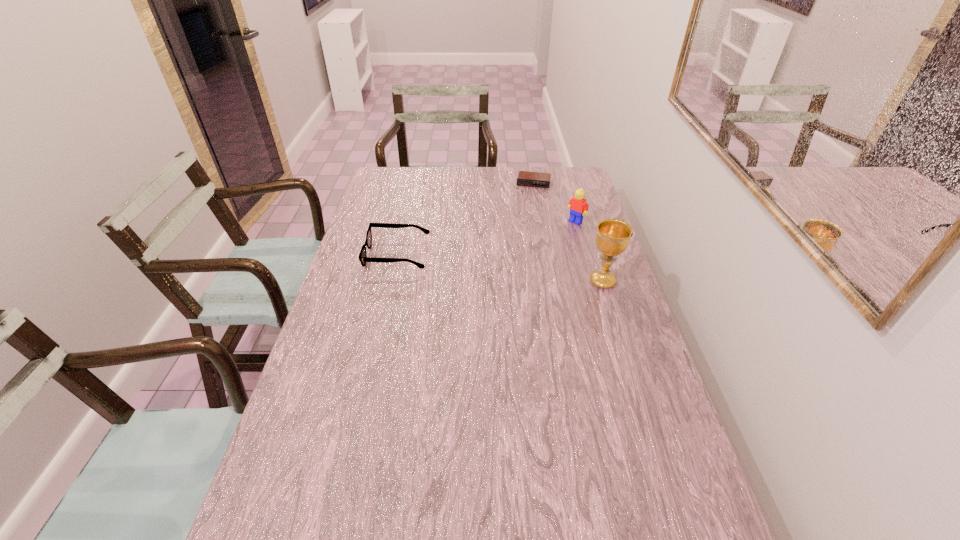
At what (x,y) coordinates should I click in order to perform the action: click on object located at the far right corner. Please return your answer as a coordinate pair (x, y). This screenshot has width=960, height=540. Looking at the image, I should click on (525, 178).

This screenshot has width=960, height=540. I want to click on vacant area at the far edge, so click(x=490, y=178).

Locate an element on the screen. Image resolution: width=960 pixels, height=540 pixels. free region at the near edge of the desktop is located at coordinates (527, 531).

Image resolution: width=960 pixels, height=540 pixels. Find the location of `free spot at the left edge of the desktop`. free spot at the left edge of the desktop is located at coordinates (365, 210).

You are a GUI agent. You are given a task and a screenshot of the screen. Output one action in this format:
    pyautogui.click(x=<x>, y=<y>)
    Task: Click on the blank space at the right edge of the desktop
    This screenshot has width=960, height=540.
    Given the screenshot: What is the action you would take?
    pyautogui.click(x=595, y=343)

Where is `vacant space at the far left corner of the desktop`? The height and width of the screenshot is (540, 960). vacant space at the far left corner of the desktop is located at coordinates (408, 173).

You are a GUI agent. You are given a task and a screenshot of the screen. Output one action in this format:
    pyautogui.click(x=<x>, y=<y>)
    Task: Click on the free location at the far right corner
    The image size is (960, 540).
    Given the screenshot: What is the action you would take?
    pyautogui.click(x=588, y=188)

Find the location of a particular element. free spot between the leftmost object and the tallest object is located at coordinates (500, 268).

This screenshot has width=960, height=540. I want to click on free space between the alarm clock and the Lego, so click(x=555, y=202).

Find the location of `vacant space in between the spectacles and the second object from left to right`. vacant space in between the spectacles and the second object from left to right is located at coordinates (x=466, y=219).